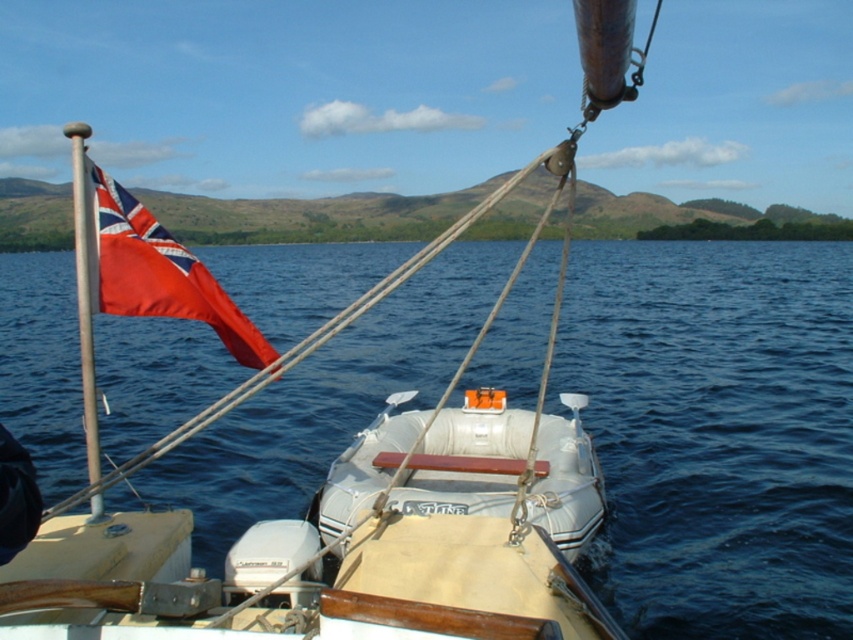
Question: Is satin red flag at upper left above metallic pole at left?

Choices:
 (A) no
 (B) yes

Answer: (B)

Question: Is the position of satin red flag at upper left more distant than that of metallic pole at left?

Choices:
 (A) yes
 (B) no

Answer: (A)

Question: Which point is closer to the camera?

Choices:
 (A) metallic pole at left
 (B) satin red flag at upper left

Answer: (A)

Question: Can you confirm if satin red flag at upper left is wider than metallic pole at left?

Choices:
 (A) yes
 (B) no

Answer: (B)

Question: Among these points, which one is nearest to the camera?

Choices:
 (A) click(x=90, y=412)
 (B) click(x=213, y=323)

Answer: (A)

Question: Which of the following is the closest to the observer?

Choices:
 (A) metallic pole at left
 (B) satin red flag at upper left

Answer: (A)